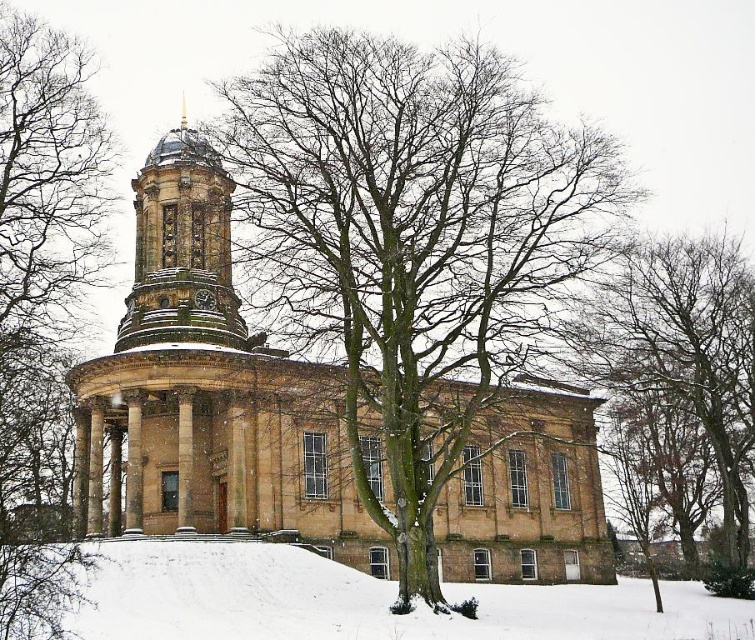
Is white powdery snow at lower center positioned in front of bare branches at right?

Yes, it is in front of bare branches at right.

Where is `white powdery snow at lower center`? white powdery snow at lower center is located at coordinates (359, 600).

Where is `white powdery snow at lower center`? The width and height of the screenshot is (755, 640). white powdery snow at lower center is located at coordinates (359, 600).

Is bare branches at center in front of golden stone clock tower at center?

Yes, it is in front of golden stone clock tower at center.

Does bare branches at center appear on the right side of golden stone clock tower at center?

Correct, you'll find bare branches at center to the right of golden stone clock tower at center.

Who is more distant from viewer, (x=402, y=465) or (x=168, y=340)?

The point (x=168, y=340) is more distant.

Identify the location of bare branches at center. This screenshot has height=640, width=755. (411, 243).

Between bare branches at center and white powdery snow at lower center, which one is positioned higher?

Positioned higher is bare branches at center.

Who is more distant from viewer, [414,401] or [236,602]?

Point [414,401]

At what (x,y) coordinates should I click in order to perform the action: click on bare branches at center. Please return your answer as a coordinate pair (x, y). Image resolution: width=755 pixels, height=640 pixels. Looking at the image, I should click on (411, 243).